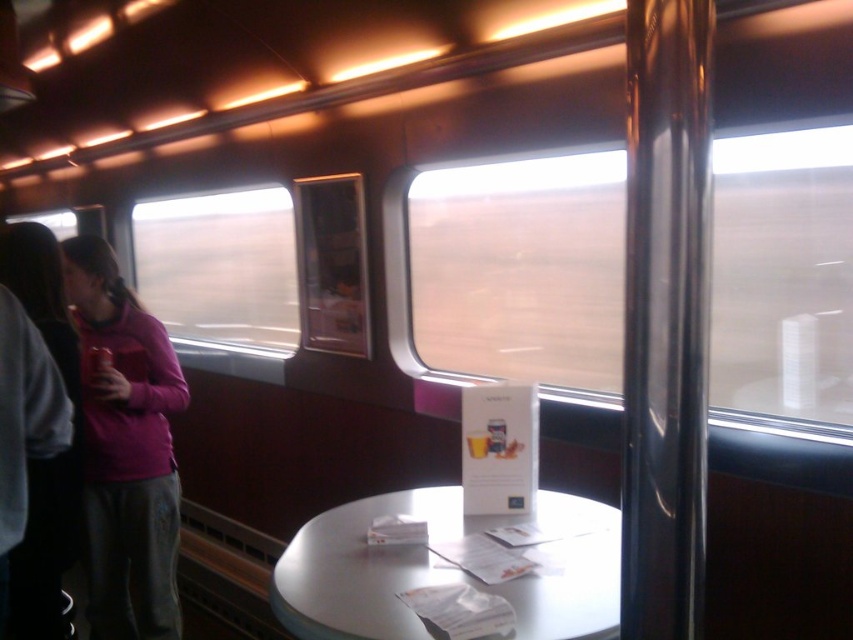
Is pink fleece jacket at left thinner than white glossy table at center?

Correct, pink fleece jacket at left's width is less than white glossy table at center's.

Who is more forward, (x=141, y=586) or (x=512, y=580)?

Point (x=512, y=580)

This screenshot has height=640, width=853. I want to click on pink fleece jacket at left, so click(x=126, y=451).

Is white glossy table at center below metallic can at left?

Yes, white glossy table at center is below metallic can at left.

Can you confirm if white glossy table at center is bigger than metallic can at left?

Yes, white glossy table at center is bigger than metallic can at left.

The width and height of the screenshot is (853, 640). Find the location of `white glossy table at center`. white glossy table at center is located at coordinates (440, 570).

Is point (207, 228) in front of point (99, 381)?

That is False.

Between transparent glass window at left and metallic can at left, which one is positioned higher?

transparent glass window at left

From the picture: Who is more distant from viewer, (247,317) or (109,349)?

Positioned behind is point (247,317).

The width and height of the screenshot is (853, 640). Identify the location of transparent glass window at left. (219, 266).